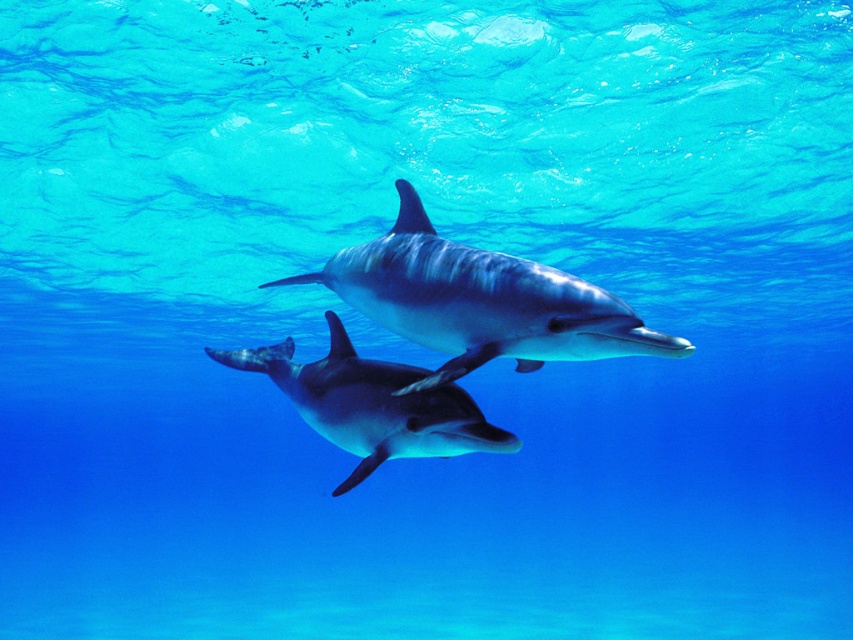
You are a marine biologist observing two points in the ocean. You see point at (421, 275) and point at (364, 433). Based on their positions, which point is closer to you?

Point at (421, 275) is in front of point at (364, 433), so it is closer to you.

You are a marine biologist observing two dolphins underwater. You notice a smooth gray dolphin at center and a glossy blue dolphin at center. Which dolphin is positioned to the right of the other?

The smooth gray dolphin at center is positioned to the right of the glossy blue dolphin at center.

You are a marine biologist studying dolphins in the ocean. You observe a point at coordinates (479,301). Which object in the image is this point located on?

The point at coordinates (479,301) is located on the smooth gray dolphin at center.